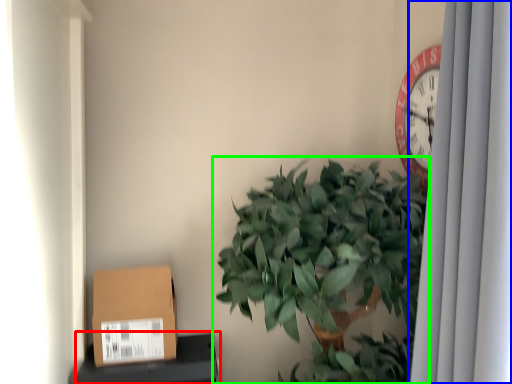
Question: Which is nearer to the furniture (highlighted by a red box)? curtain (highlighted by a blue box) or houseplant (highlighted by a green box).

Choices:
 (A) curtain
 (B) houseplant

Answer: (B)